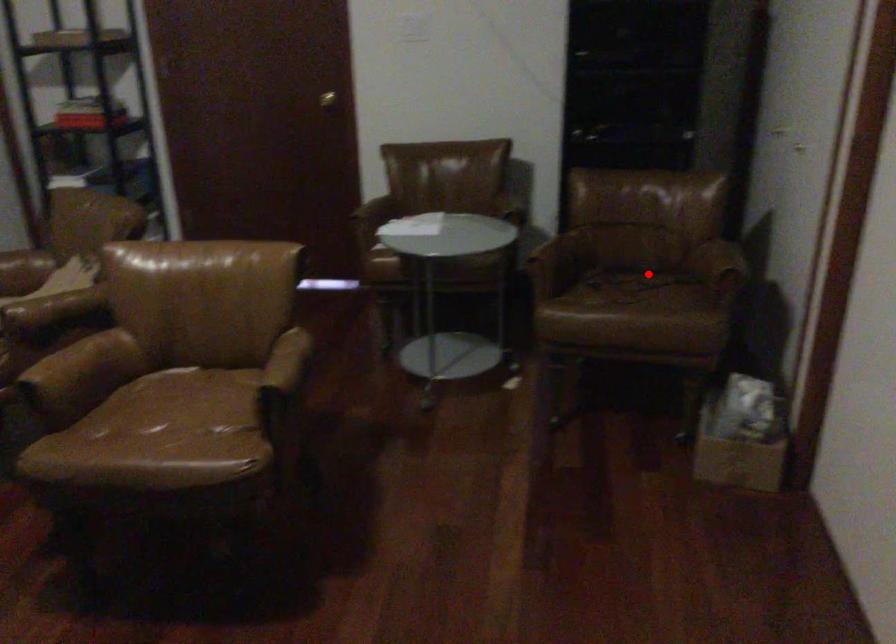
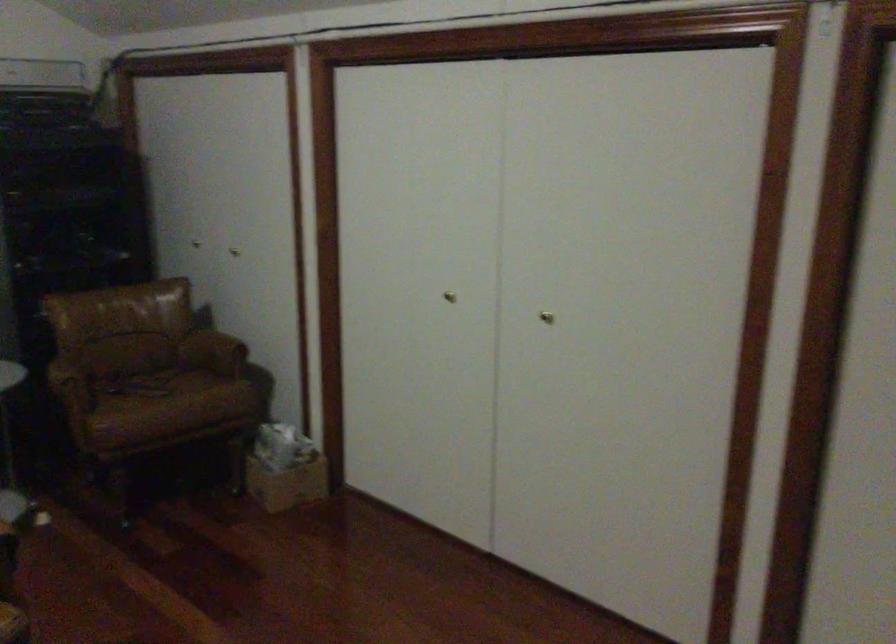
The point at the highlighted location is marked in the first image. Where is the corresponding point in the second image?

(149, 370)